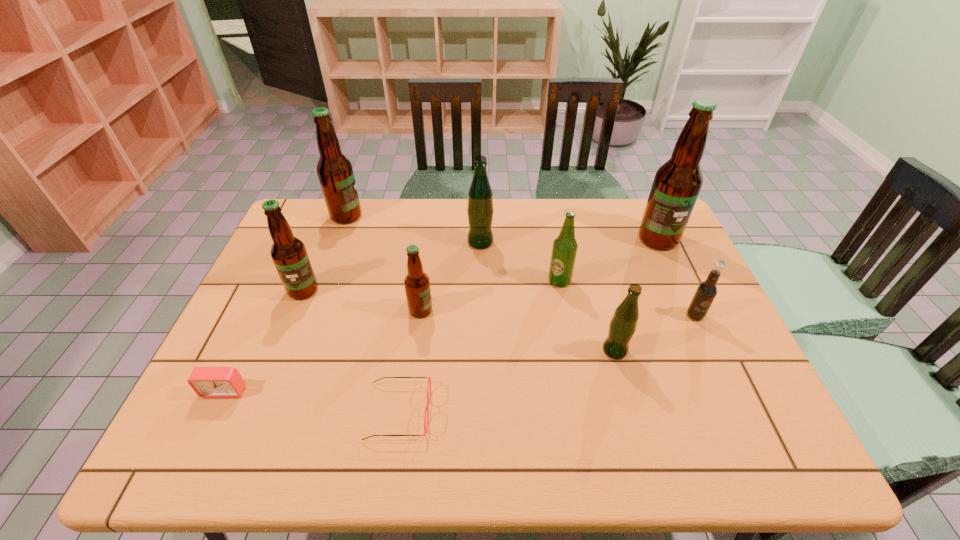
I want to click on beer bottle situated at the right edge, so click(x=677, y=183).

I want to click on root beer that is at the right edge, so click(x=707, y=290).

This screenshot has width=960, height=540. Identify the location of object located at the far left corner. (334, 170).

I want to click on object at the far right corner, so click(x=677, y=183).

Locate an element on the screen. The image size is (960, 540). vacant space at the far edge of the desktop is located at coordinates (577, 217).

Where is `vacant space at the near edge of the desktop`? vacant space at the near edge of the desktop is located at coordinates (632, 440).

Where is `vacant space at the left edge`? The height and width of the screenshot is (540, 960). vacant space at the left edge is located at coordinates pos(253,303).

Where is `free space at the right edge of the desktop`? free space at the right edge of the desktop is located at coordinates (698, 376).

Where is `vacant area at the far left corner`? The width and height of the screenshot is (960, 540). vacant area at the far left corner is located at coordinates (306, 235).

The width and height of the screenshot is (960, 540). I want to click on vacant space at the near right corner of the desktop, so click(x=738, y=456).